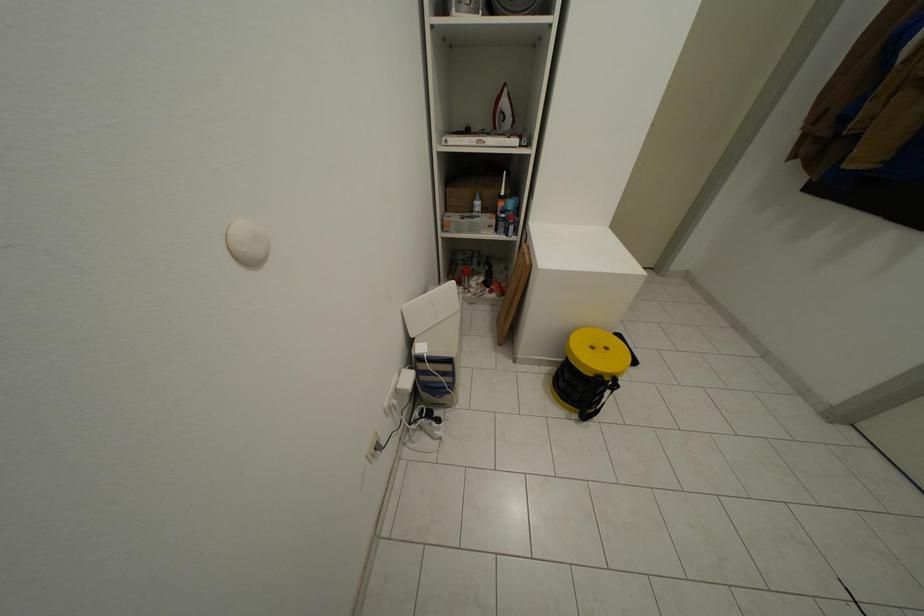
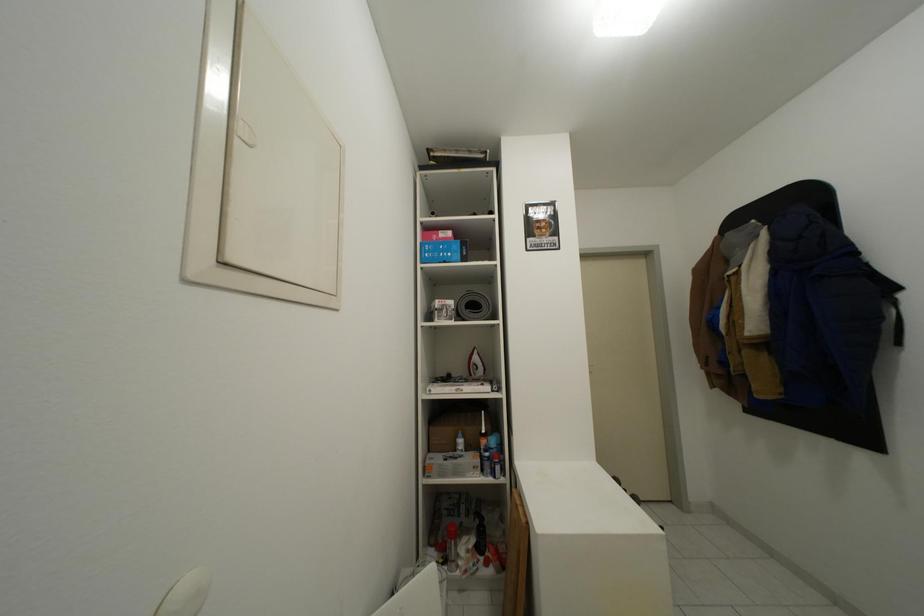
Question: How did the camera likely rotate?

Choices:
 (A) Left
 (B) Right
 (C) Up
 (D) Down

Answer: (C)